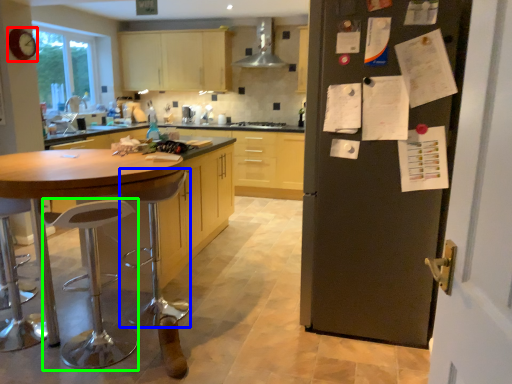
Question: Estimate the real-world distances between objects in this image. Which object is closer to clock (highlighted by a red box), bar stool (highlighted by a blue box) or bar stool (highlighted by a green box)?

Choices:
 (A) bar stool
 (B) bar stool

Answer: (B)